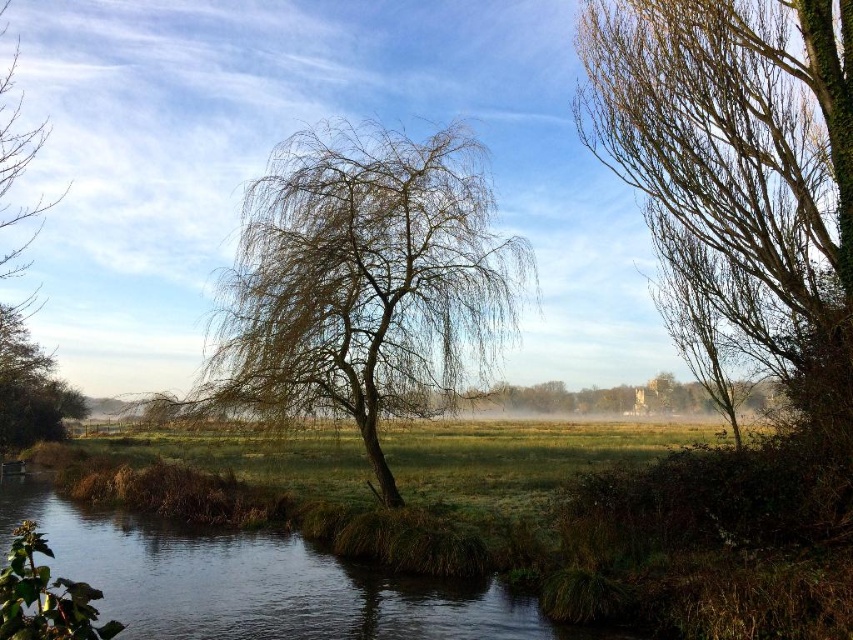
You are standing at the center of the image and want to walk towards the brown leafy tree at upper left. Which direction should you face to ensure you are moving towards it without obstacles from the green grassy river at lower left?

You should face towards the upper left direction to move towards the brown leafy tree at upper left. The green grassy river at lower left is located to the right of the tree, so facing upper left will keep the river to your right and avoid obstacles.

You are a painter setting up your easel to capture the scene. You want to ensure both the brown textured tree at center and the brown leafy tree at upper left are visible in your painting. Given their sizes, which tree should you position closer to the center of your canvas to maintain their relative sizes as seen in the image?

The brown textured tree at center has a lesser width compared to the brown leafy tree at upper left, so to maintain their relative sizes, you should position the brown leafy tree at upper left closer to the center of the canvas since it is wider and would require more space to depict accurately.

You are standing at the edge of the water and want to walk towards the brown textured tree at center. Which direction should you head relative to the brown leafy tree at upper left?

You should head to the right of the brown leafy tree at upper left to reach the brown textured tree at center.